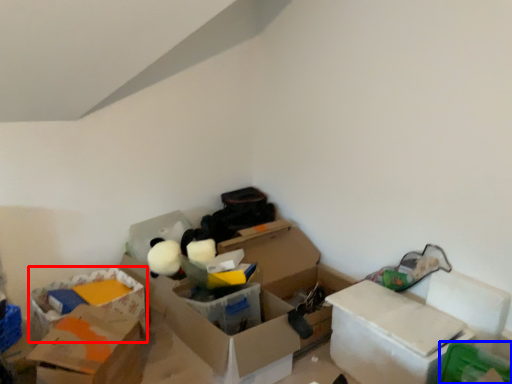
Question: Which object is closer to the camera taking this photo, storage box (highlighted by a red box) or storage box (highlighted by a blue box)?

Choices:
 (A) storage box
 (B) storage box

Answer: (B)